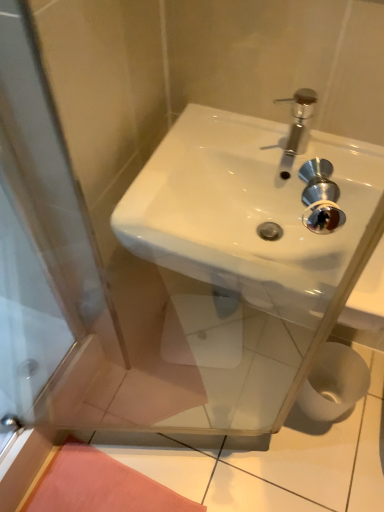
The width and height of the screenshot is (384, 512). In order to click on vacant space to the left of white matte toilet paper at lower right in this screenshot , I will do `click(265, 382)`.